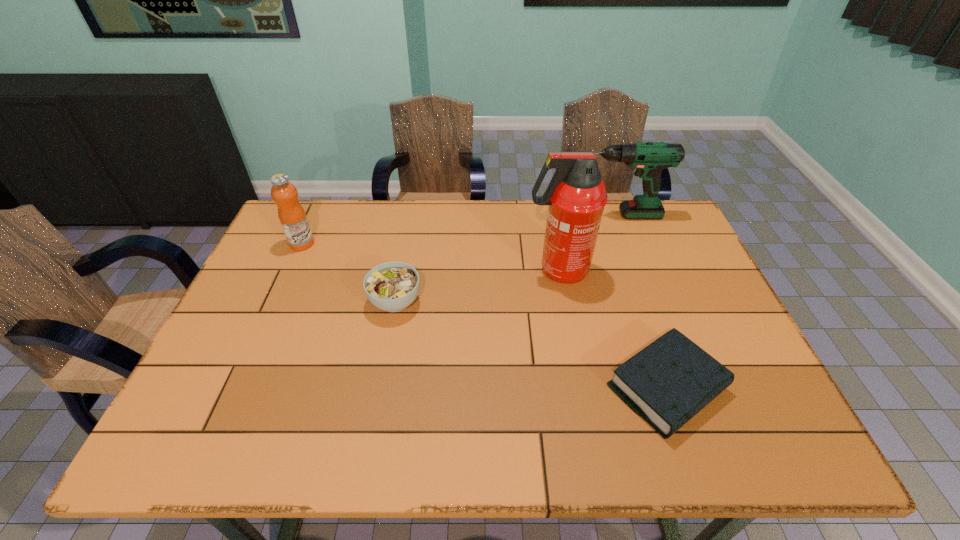
Image resolution: width=960 pixels, height=540 pixels. Find the location of `the tallest object`. the tallest object is located at coordinates (576, 196).

Locate an element on the screen. the farthest object is located at coordinates (649, 158).

Where is `the leftmost object`? This screenshot has width=960, height=540. the leftmost object is located at coordinates (292, 216).

Find the location of a particular element. The height and width of the screenshot is (540, 960). fruit juice is located at coordinates coord(292,216).

Where is `the fourth object from right to left`? the fourth object from right to left is located at coordinates [392, 286].

At what (x,y) coordinates should I click in order to perform the action: click on soup bowl. Please return your answer as a coordinate pair (x, y). The height and width of the screenshot is (540, 960). Looking at the image, I should click on (392, 286).

Find the location of a particular element. This screenshot has width=960, height=540. Bible is located at coordinates (667, 383).

Where is `the shortest object`? The width and height of the screenshot is (960, 540). the shortest object is located at coordinates (667, 383).

The image size is (960, 540). I want to click on free spot located 0.240m on the trigger side of the tallest object, so click(444, 271).

Image resolution: width=960 pixels, height=540 pixels. Find the location of `vacant space located on the trigger side of the tallest object`. vacant space located on the trigger side of the tallest object is located at coordinates (430, 271).